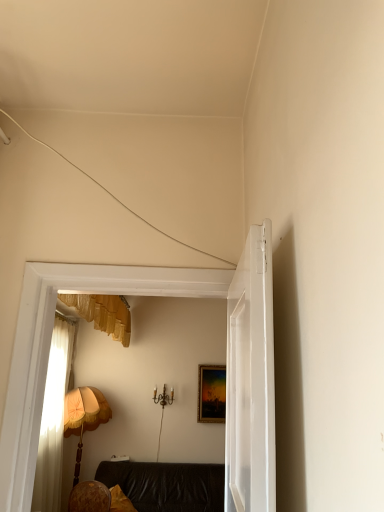
Question: Considering the positions of wooden fabric lampshade at left and leather couch at center in the image, is wooden fabric lampshade at left bigger or smaller than leather couch at center?

Choices:
 (A) big
 (B) small

Answer: (B)

Question: From a real-world perspective, is wooden fabric lampshade at left above or below leather couch at center?

Choices:
 (A) above
 (B) below

Answer: (A)

Question: Which object is positioned farthest from the white glossy door at center?

Choices:
 (A) yellow fabric pillow at lower left
 (B) gold-framed painting at center
 (C) wooden fabric lampshade at left
 (D) leather couch at center

Answer: (B)

Question: Which object is the farthest from the yellow fabric pillow at lower left?

Choices:
 (A) gold-framed painting at center
 (B) white glossy door at center
 (C) leather couch at center
 (D) wooden fabric lampshade at left

Answer: (B)